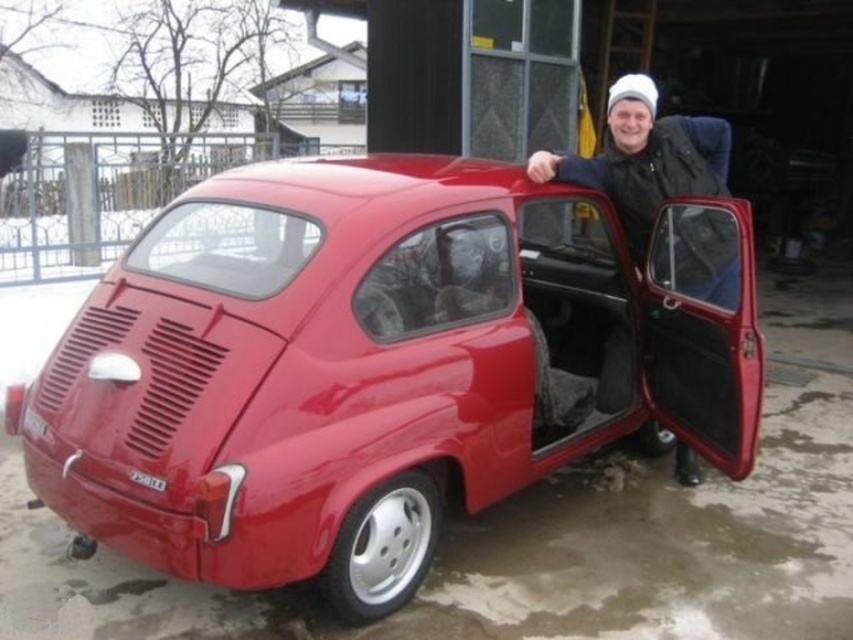
Does glossy red car door at right appear under white knit cap at upper center?

Yes.

Describe the element at coordinates (704, 330) in the screenshot. The width and height of the screenshot is (853, 640). I see `glossy red car door at right` at that location.

Which is behind, point (733, 216) or point (634, 92)?

The point (634, 92) is more distant.

In order to click on glossy red car door at right in this screenshot , I will do [x=704, y=330].

Which of these two, glossy red car at center or glossy red car door at right, stands shorter?

glossy red car door at right is shorter.

Image resolution: width=853 pixels, height=640 pixels. What do you see at coordinates (378, 365) in the screenshot?
I see `glossy red car at center` at bounding box center [378, 365].

Locate an element on the screen. The width and height of the screenshot is (853, 640). glossy red car at center is located at coordinates (378, 365).

Is glossy red car at center shorter than white knit cap at upper center?

No, glossy red car at center is not shorter than white knit cap at upper center.

Which is above, glossy red car at center or white knit cap at upper center?

white knit cap at upper center

Measure the distance between point (339, 381) and camera.

Point (339, 381) and camera are 2.63 meters apart from each other.

Where is `glossy red car at center`? glossy red car at center is located at coordinates [x=378, y=365].